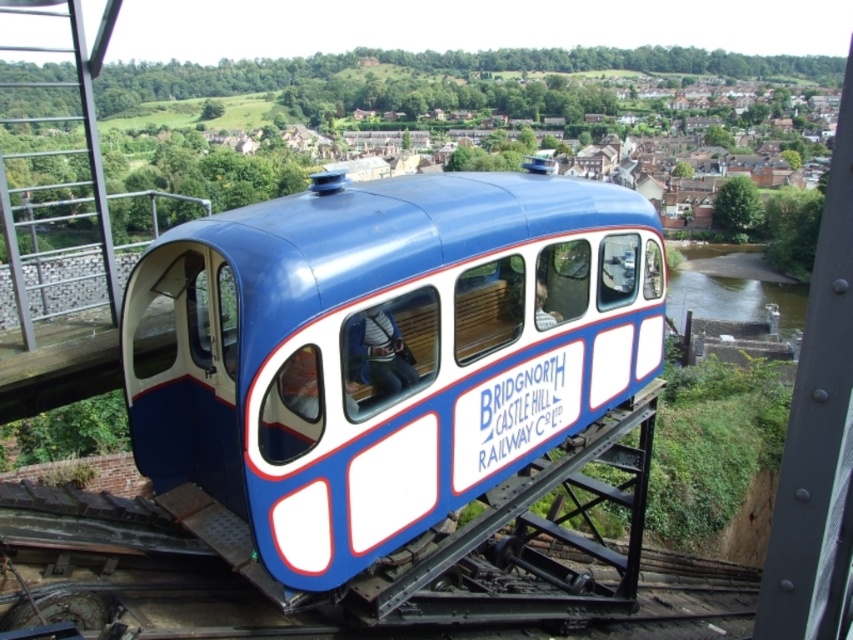
Question: Which point appears farthest from the camera in this image?

Choices:
 (A) (532, 346)
 (B) (718, 253)

Answer: (B)

Question: Is blue glossy train car at center positioned behind matte blue coach at center?

Choices:
 (A) yes
 (B) no

Answer: (B)

Question: Is green smooth water at lower right further to the viewer compared to matte blue coach at center?

Choices:
 (A) yes
 (B) no

Answer: (A)

Question: Can you confirm if blue glossy train car at center is wider than matte blue coach at center?

Choices:
 (A) yes
 (B) no

Answer: (A)

Question: Which object is closer to the camera taking this photo?

Choices:
 (A) matte blue coach at center
 (B) green smooth water at lower right

Answer: (A)

Question: Which point is closer to the camera?

Choices:
 (A) (512, 412)
 (B) (744, 296)
 (C) (386, 364)

Answer: (C)